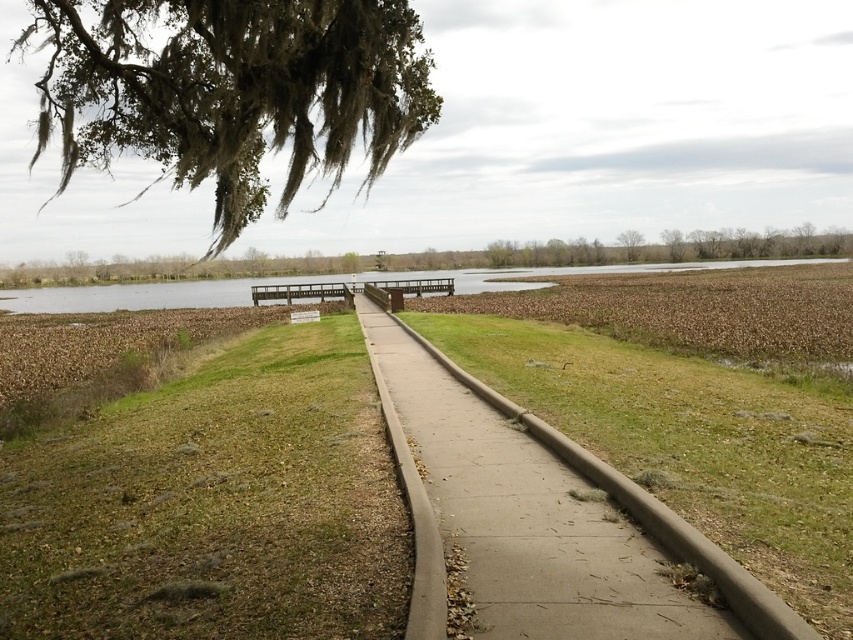
You are standing at the wooden dock and want to walk back to the tree with hanging moss. You see two points marked on the ground ahead of you. Which point, point (236, 449) or point (523, 467), is closer to you as you face the dock?

Point (236, 449) is closer to you because it is further to the viewer than point (523, 467), meaning it is nearer in the scene.